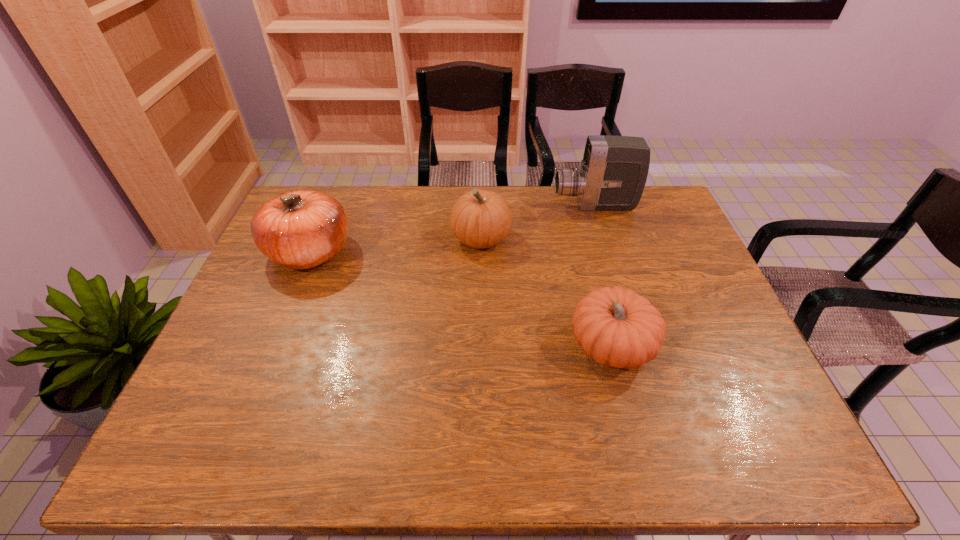
Identify the location of vacant space at the near edge. The image size is (960, 540). (314, 460).

Find the location of a particular element. This screenshot has width=960, height=540. free space at the left edge of the desktop is located at coordinates [x=284, y=295].

The height and width of the screenshot is (540, 960). I want to click on vacant space at the right edge of the desktop, so click(x=669, y=280).

What are the coordinates of `vacant region at the far right corner` in the screenshot? It's located at (661, 221).

I want to click on vacant area between the tallest object and the third object from right to left, so click(538, 222).

The width and height of the screenshot is (960, 540). What are the coordinates of `free area in between the leftmost pumpkin and the second pumpkin from right to left` in the screenshot? It's located at (396, 245).

Locate an element on the screen. free area in between the tallest object and the shortest object is located at coordinates (603, 276).

Locate an element on the screen. unoccupied area between the farthest object and the second object from left to right is located at coordinates coord(538,222).

Where is `vacant space that is in between the tallest object and the third object from right to left`? vacant space that is in between the tallest object and the third object from right to left is located at coordinates (538, 222).

The image size is (960, 540). What are the coordinates of `free space between the camcorder and the third object from right to left` in the screenshot? It's located at (538, 222).